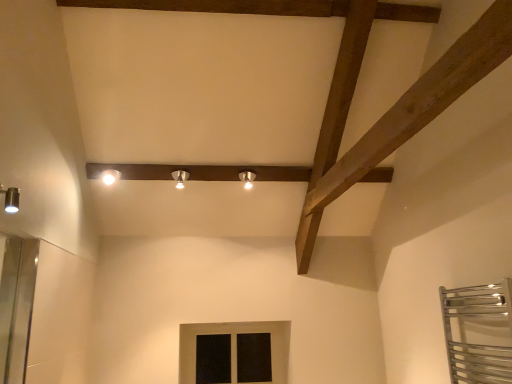
Question: Does matte silver spotlight at center, positioned as the 2th light fixture in left-to-right order, have a greater height compared to white glossy spotlight at upper center, placed as the third light fixture when sorted from right to left?

Choices:
 (A) no
 (B) yes

Answer: (B)

Question: Does matte silver spotlight at center, positioned as the 2th light fixture in left-to-right order, have a smaller size compared to white glossy spotlight at upper center, placed as the third light fixture when sorted from right to left?

Choices:
 (A) yes
 (B) no

Answer: (A)

Question: Does matte silver spotlight at center, marked as the 2th light fixture in a right-to-left arrangement, contain white glossy spotlight at upper center, placed as the third light fixture when sorted from right to left?

Choices:
 (A) no
 (B) yes

Answer: (A)

Question: Is matte silver spotlight at center, positioned as the 2th light fixture in left-to-right order, far from white glossy spotlight at upper center, the 1th light fixture positioned from the left?

Choices:
 (A) no
 (B) yes

Answer: (A)

Question: Does matte silver spotlight at center, positioned as the 2th light fixture in left-to-right order, have a greater width compared to white glossy spotlight at upper center, placed as the third light fixture when sorted from right to left?

Choices:
 (A) no
 (B) yes

Answer: (A)

Question: From their relative heights in the image, would you say matte silver spotlight at center, marked as the 2th light fixture in a right-to-left arrangement, is taller or shorter than black glass window at center?

Choices:
 (A) short
 (B) tall

Answer: (A)

Question: Would you say matte silver spotlight at center, marked as the 2th light fixture in a right-to-left arrangement, is inside or outside black glass window at center?

Choices:
 (A) inside
 (B) outside

Answer: (B)

Question: From the image's perspective, is matte silver spotlight at center, positioned as the 2th light fixture in left-to-right order, positioned above or below black glass window at center?

Choices:
 (A) below
 (B) above

Answer: (B)

Question: Is matte silver spotlight at center, marked as the 2th light fixture in a right-to-left arrangement, to the left or to the right of black glass window at center in the image?

Choices:
 (A) left
 (B) right

Answer: (A)

Question: In the image, is white glossy spotlight at upper center, placed as the third light fixture when sorted from right to left, on the left side or the right side of black glass window at center?

Choices:
 (A) right
 (B) left

Answer: (B)

Question: From the image's perspective, is white glossy spotlight at upper center, the 1th light fixture positioned from the left, above or below black glass window at center?

Choices:
 (A) above
 (B) below

Answer: (A)

Question: Relative to black glass window at center, is white glossy spotlight at upper center, the 1th light fixture positioned from the left, in front or behind?

Choices:
 (A) front
 (B) behind

Answer: (A)

Question: Considering the positions of white glossy spotlight at upper center, the 1th light fixture positioned from the left, and black glass window at center in the image, is white glossy spotlight at upper center, the 1th light fixture positioned from the left, wider or thinner than black glass window at center?

Choices:
 (A) thin
 (B) wide

Answer: (B)

Question: Is black glass window at center taller or shorter than matte silver spotlight at center, positioned as the 2th light fixture in left-to-right order?

Choices:
 (A) short
 (B) tall

Answer: (B)

Question: In terms of width, does black glass window at center look wider or thinner when compared to matte silver spotlight at center, positioned as the 2th light fixture in left-to-right order?

Choices:
 (A) thin
 (B) wide

Answer: (A)